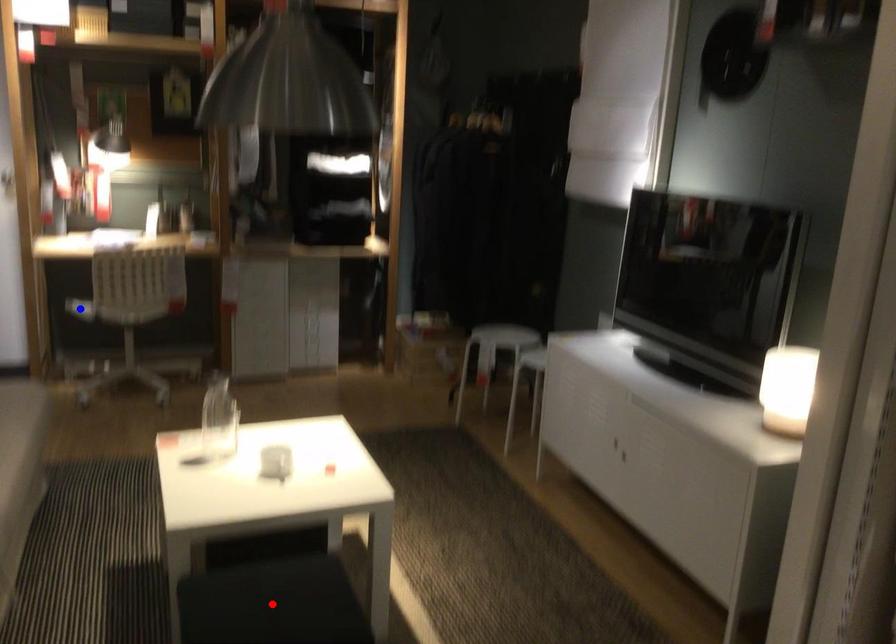
Question: In the image, two points are highlighted. Which point is nearer to the camera? Reply with the corresponding letter.

Choices:
 (A) blue point
 (B) red point

Answer: (B)